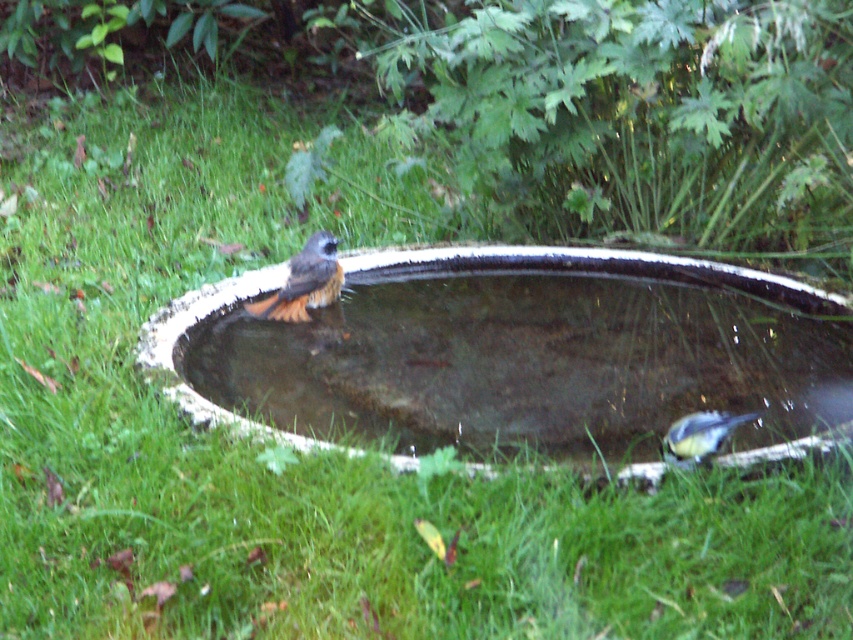
Who is more distant from viewer, (x=503, y=417) or (x=338, y=269)?

The point (x=338, y=269) is more distant.

Which is in front, point (183, 346) or point (328, 241)?

Point (183, 346) is in front.

Where is `smooth concrete basin at center`? This screenshot has width=853, height=640. smooth concrete basin at center is located at coordinates (515, 355).

Is smooth concrete basin at center taller than blue-green feathers at lower right?

Correct, smooth concrete basin at center is much taller as blue-green feathers at lower right.

Is point (648, 310) farther from viewer compared to point (682, 429)?

Yes, point (648, 310) is farther from viewer.

Identify the location of smooth concrete basin at center. click(515, 355).

Who is positioned more to the left, brown speckled feathers at center or blue-green feathers at lower right?

brown speckled feathers at center

Is brown speckled feathers at center positioned in front of blue-green feathers at lower right?

That is False.

Describe the element at coordinates (305, 282) in the screenshot. I see `brown speckled feathers at center` at that location.

This screenshot has width=853, height=640. Find the location of `brown speckled feathers at center`. brown speckled feathers at center is located at coordinates (305, 282).